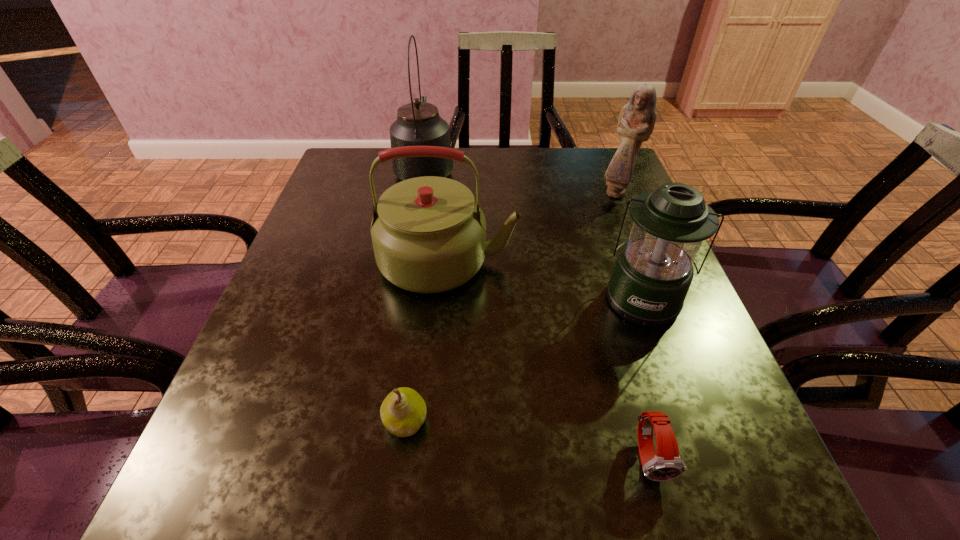
This screenshot has width=960, height=540. I want to click on the taller kettle, so click(x=418, y=123).

Locate an element on the screen. This screenshot has width=960, height=540. the farther kettle is located at coordinates (418, 123).

You are a GUI agent. You are given a task and a screenshot of the screen. Output one action in this format:
    pyautogui.click(x=<x>, y=<y>)
    Task: Click on the figurine
    The height and width of the screenshot is (540, 960).
    Given the screenshot: What is the action you would take?
    pyautogui.click(x=636, y=122)

The image size is (960, 540). Identify the location of the shorter kettle. (429, 236).

I want to click on lantern, so pos(653,273).

I want to click on pear, so click(403, 411).

At what (x,y) coordinates should I click in order to perform the action: click on watch. Please return your answer as a coordinate pair (x, y). The image size is (960, 540). Looking at the image, I should click on (667, 465).

You are a GUI agent. You are given a task and a screenshot of the screen. Output one action in this format:
    pyautogui.click(x=<x>, y=<y>)
    Task: Click on the free space located 0.150m on the front-facing side of the figurine
    
    Given the screenshot: What is the action you would take?
    pyautogui.click(x=636, y=241)

Find the location of a particular element. This screenshot has width=960, height=540. vacant space located 0.090m at the spout of the nearer kettle is located at coordinates (561, 261).

The image size is (960, 540). Identify the location of free space located on the left of the lantern. (555, 298).